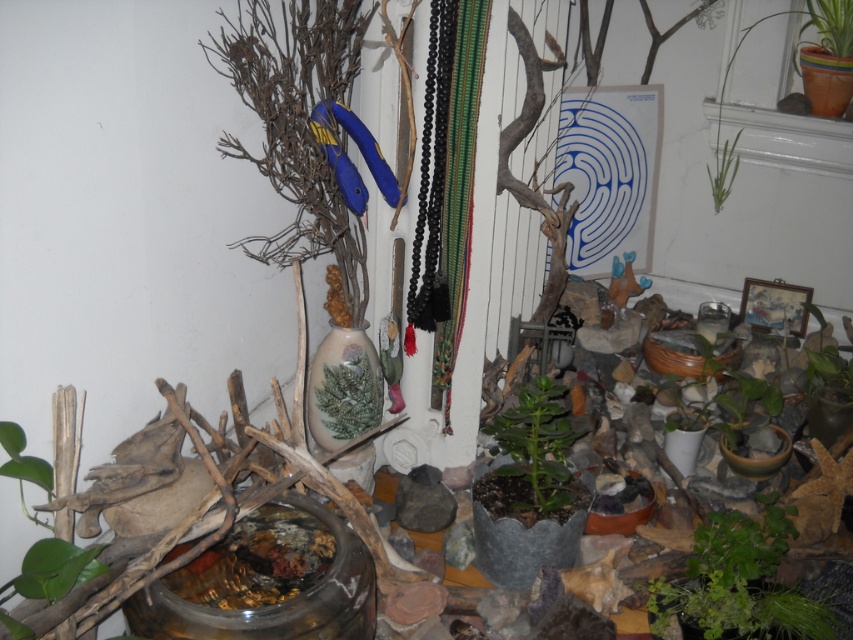
Question: Among these objects, which one is farthest from the camera?

Choices:
 (A) green leafy plant at upper right
 (B) green matte plant at center
 (C) green matte plant at center-right
 (D) green leafy plant at lower right

Answer: (A)

Question: Is green matte plant at center to the right of green matte plant at center-right from the viewer's perspective?

Choices:
 (A) no
 (B) yes

Answer: (A)

Question: Among these points, which one is farthest from the camera?

Choices:
 (A) (776, 406)
 (B) (354, 408)
 (C) (737, 532)
 (D) (512, 429)

Answer: (A)

Question: Does green matte plant at center have a larger size compared to green leafy plant at center?

Choices:
 (A) no
 (B) yes

Answer: (B)

Question: Does green matte plant at center have a lesser width compared to green matte plant at center-right?

Choices:
 (A) no
 (B) yes

Answer: (A)

Question: Which of the following is the farthest from the observer?

Choices:
 (A) green leafy plant at upper right
 (B) green matte plant at center-right

Answer: (A)